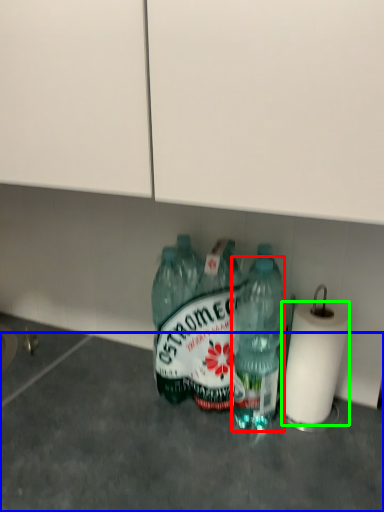
Question: Which is farther away from bottle (highlighted by a red box)? concrete (highlighted by a blue box) or paper towel (highlighted by a green box)?

Choices:
 (A) concrete
 (B) paper towel

Answer: (A)